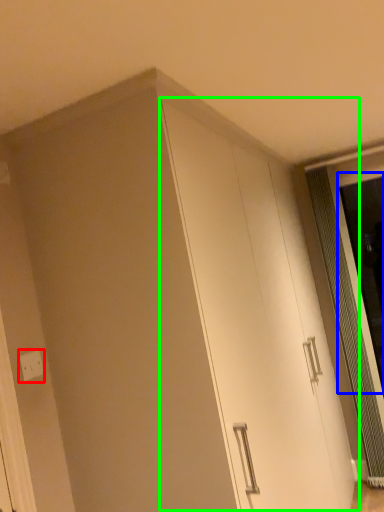
Question: Based on their relative distances, which object is farther from electric outlet (highlighted by a red box)? Choose from screen door (highlighted by a blue box) and cabinetry (highlighted by a green box).

Choices:
 (A) screen door
 (B) cabinetry

Answer: (A)